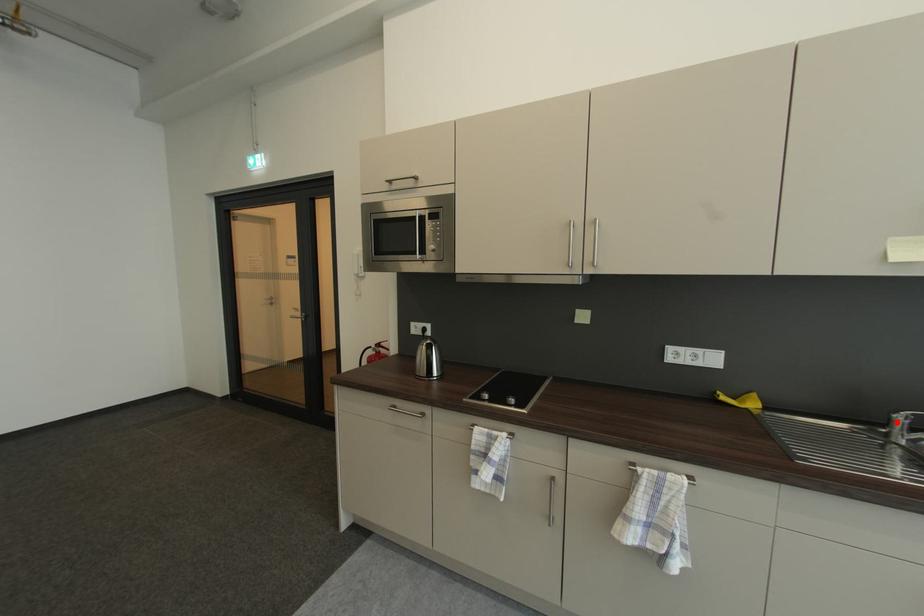
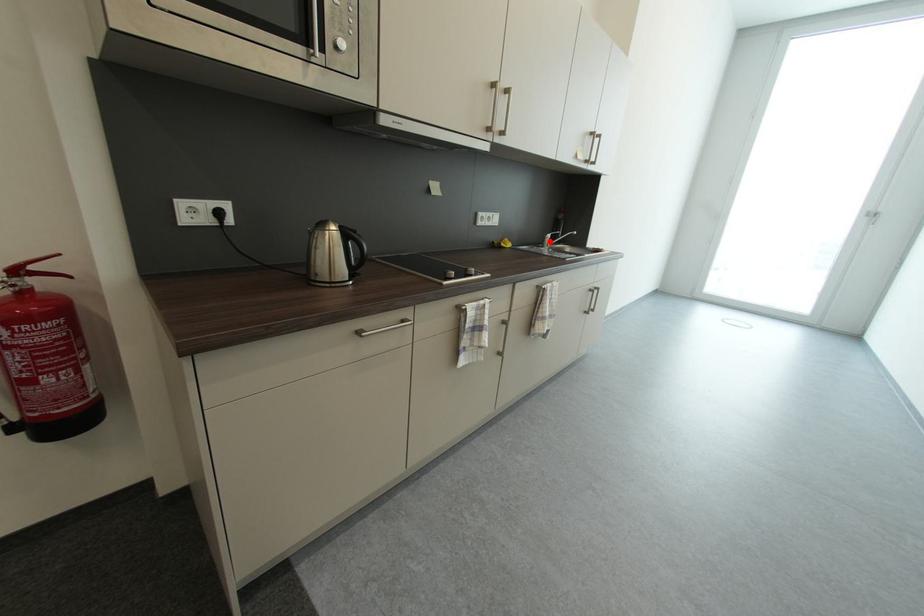
I am providing you with two images of the same scene from different viewpoints. A red point is marked on the first image and another point is marked on the second image. Are the points marked in image1 and image2 representing the same 3D position?

Yes